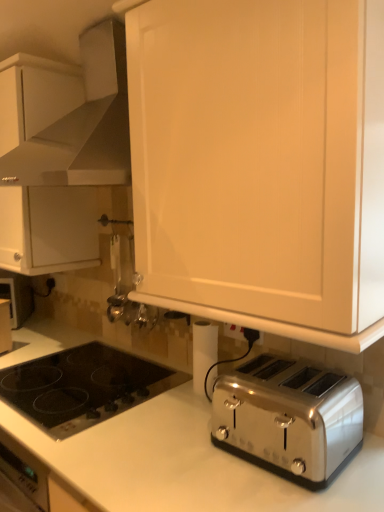
Question: Is satin chrome toaster at lower right spatially inside black glass cooktop at lower left, or outside of it?

Choices:
 (A) inside
 (B) outside

Answer: (B)

Question: Considering their positions, is satin chrome toaster at lower right located in front of or behind black glass cooktop at lower left?

Choices:
 (A) behind
 (B) front

Answer: (B)

Question: Estimate the real-world distances between objects in this image. Which object is closer to the black glass cooktop at lower left?

Choices:
 (A) satin white range hood at upper center
 (B) white matte cabinet at upper center, which is counted as the first cabinetry, starting from the front
 (C) white plastic electric outlet at lower center
 (D) white matte cabinet at upper left, which is the 1th cabinetry in back-to-front order
 (E) satin chrome toaster at lower right

Answer: (E)

Question: Based on their relative distances, which object is nearer to the white matte cabinet at upper left, the second cabinetry viewed from the right?

Choices:
 (A) white plastic electric outlet at lower center
 (B) satin white range hood at upper center
 (C) satin chrome toaster at lower right
 (D) white matte cabinet at upper center, which is the 2th cabinetry in back-to-front order
 (E) black glass cooktop at lower left

Answer: (B)